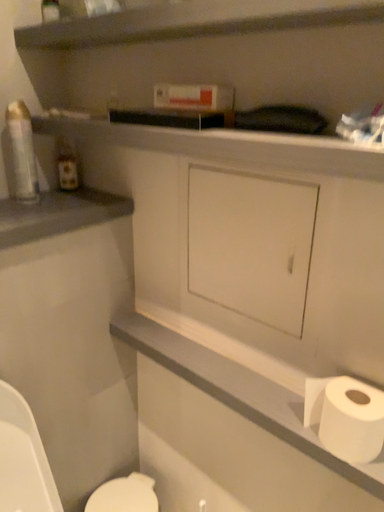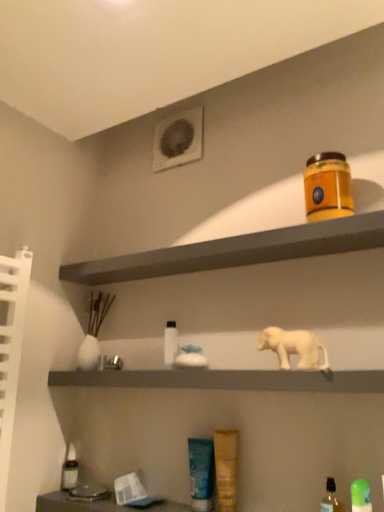
Question: Which way did the camera rotate in the video?

Choices:
 (A) rotated right
 (B) rotated left

Answer: (A)